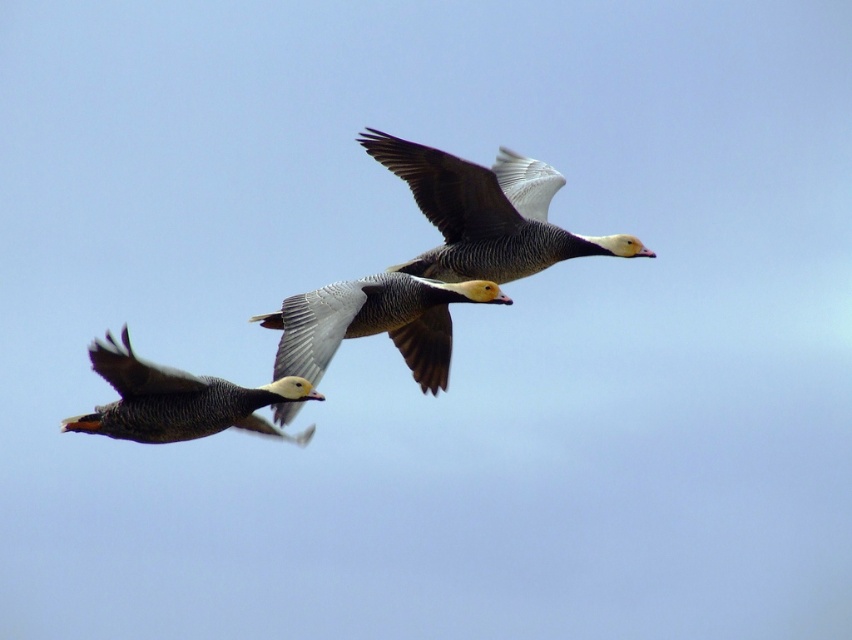
Between point (521, 163) and point (248, 428), which one is positioned behind?

Positioned behind is point (521, 163).

Between point (531, 241) and point (82, 422), which one is positioned in front?

Positioned in front is point (82, 422).

Identify the location of speckled feathered goose at upper center. The width and height of the screenshot is (852, 640). (486, 212).

Can you confirm if speckled feathered goose at upper center is bigger than speckled feathered duck at center?

Correct, speckled feathered goose at upper center is larger in size than speckled feathered duck at center.

Consider the image. Is speckled feathered goose at upper center to the right of speckled feathered duck at center from the viewer's perspective?

Indeed, speckled feathered goose at upper center is positioned on the right side of speckled feathered duck at center.

Is point (464, 214) farther from camera compared to point (383, 330)?

Yes, point (464, 214) is farther from viewer.

At what (x,y) coordinates should I click in order to perform the action: click on speckled feathered goose at upper center. Please return your answer as a coordinate pair (x, y). Looking at the image, I should click on (486, 212).

Which is more to the right, speckled feathered duck at center or speckled feathered goose at left?

speckled feathered duck at center

Which is in front, point (441, 308) or point (246, 396)?

Point (246, 396) is more forward.

Who is more distant from viewer, (475, 285) or (135, 412)?

The point (475, 285) is more distant.

Where is `speckled feathered duck at center`? speckled feathered duck at center is located at coordinates (373, 323).